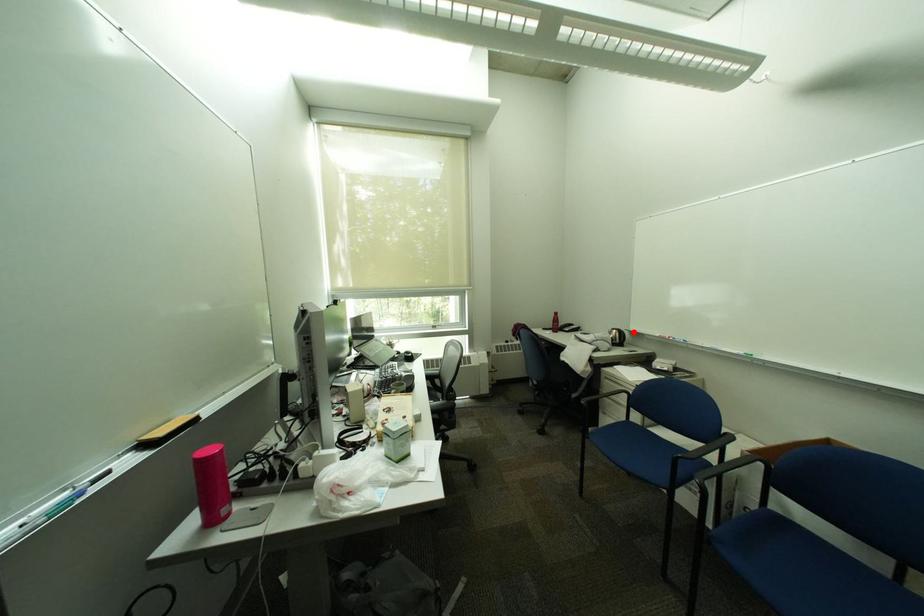
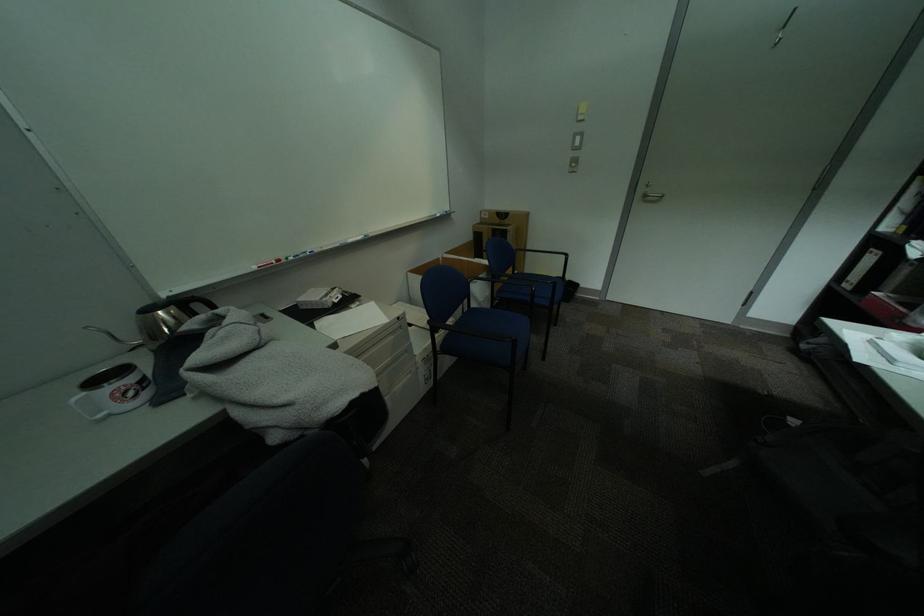
Locate, in the second image, the point that corresponds to the highlighted location in the first image.

(204, 297)